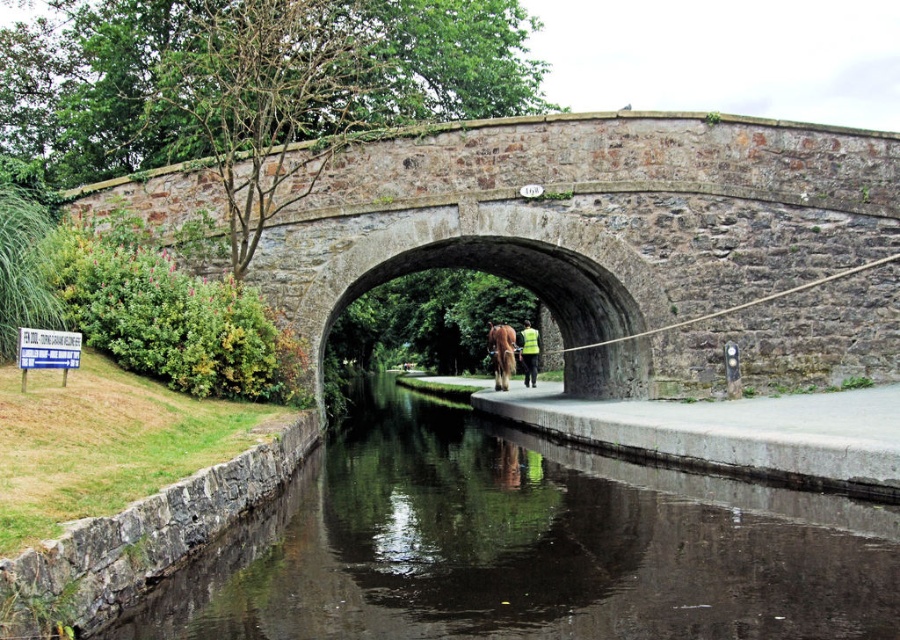
You are standing on the smooth concrete path at center and want to see your reflection. Can you see your reflection in the dark reflective water at center?

The dark reflective water at center has a lesser height compared to the smooth concrete path at center, so you can see your reflection in the dark reflective water at center since it is lower than the path you are standing on.

You are standing on a path near the rustic stone bridge at center and the dark reflective water at center. If you want to take a photo of both objects, which one should you focus on first to ensure it is in clear view?

You should focus on the rustic stone bridge at center first because it is closer to you than the dark reflective water at center, so it will be in clear view before the water.

You are a tourist standing on the grassy area to the left of the scene. You want to take a photo of the rustic stone bridge at center and the dark reflective water at center. Which object will appear larger in your photo?

The rustic stone bridge at center will appear larger in your photo because it is taller than the dark reflective water at center.